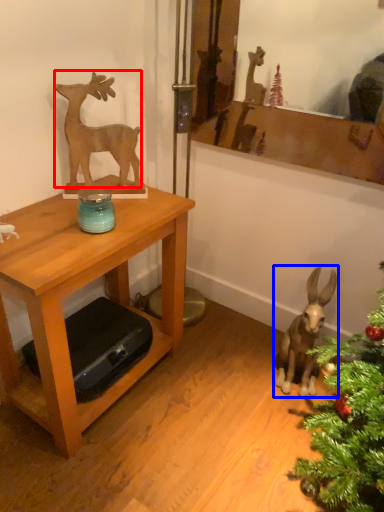
Question: Which object is closer to the camera taking this photo, deer (highlighted by a red box) or animal (highlighted by a blue box)?

Choices:
 (A) deer
 (B) animal

Answer: (A)